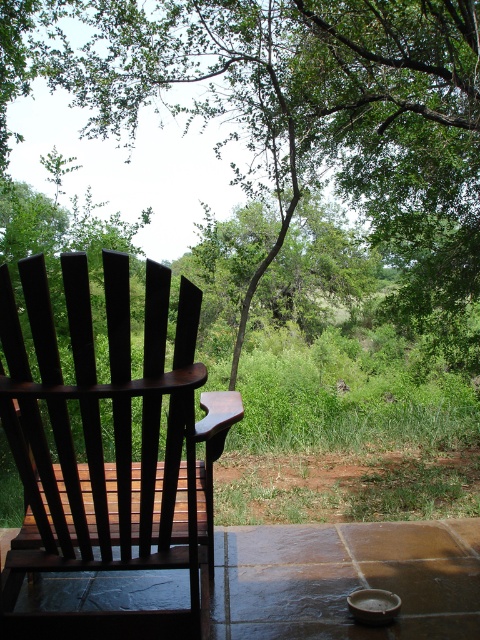
You are standing at the edge of the balcony and want to take a photo of the green leafy tree at upper center. Your camera has a maximum focus range of 6 meters. Will the camera be able to focus on the tree?

The distance between the green leafy tree at upper center and the camera is 6.51 meters, which exceeds the camera maximum focus range of 6 meters. Therefore, the camera will not be able to focus on the tree.

You are sitting in the dark wood rocking chair at left and want to look at the green leafy tree at upper center. In which direction should you turn your head?

You should turn your head to the right because the green leafy tree at upper center is to the right of the dark wood rocking chair at left.